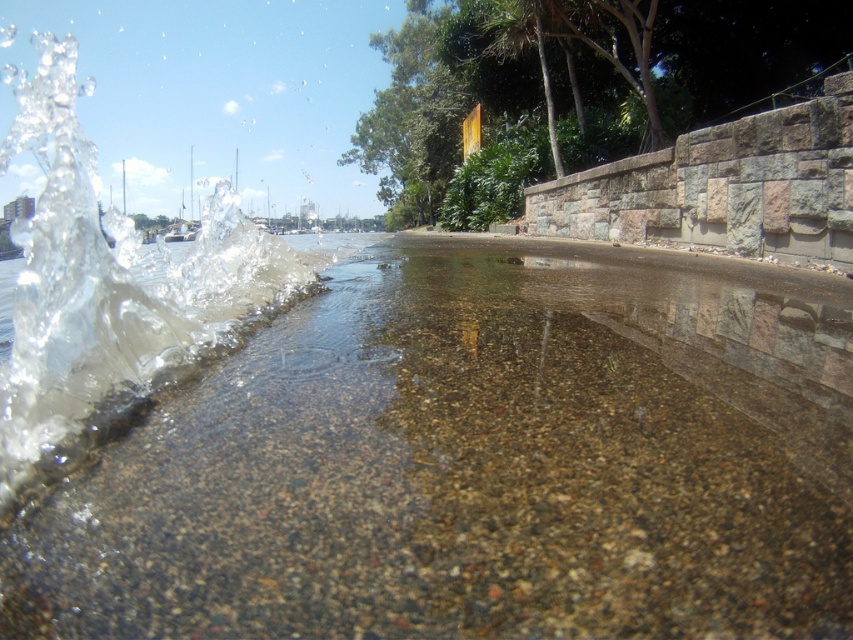
Question: Is clear water at left positioned behind clear liquid water at left?

Choices:
 (A) yes
 (B) no

Answer: (B)

Question: Which object is closer to the camera taking this photo?

Choices:
 (A) clear water at left
 (B) clear liquid water at left

Answer: (A)

Question: Which object appears closest to the camera in this image?

Choices:
 (A) clear water at left
 (B) clear liquid water at left

Answer: (A)

Question: From the image, what is the correct spatial relationship of clear water at left in relation to clear liquid water at left?

Choices:
 (A) left
 (B) right

Answer: (B)

Question: Can you confirm if clear water at left is positioned below clear liquid water at left?

Choices:
 (A) yes
 (B) no

Answer: (A)